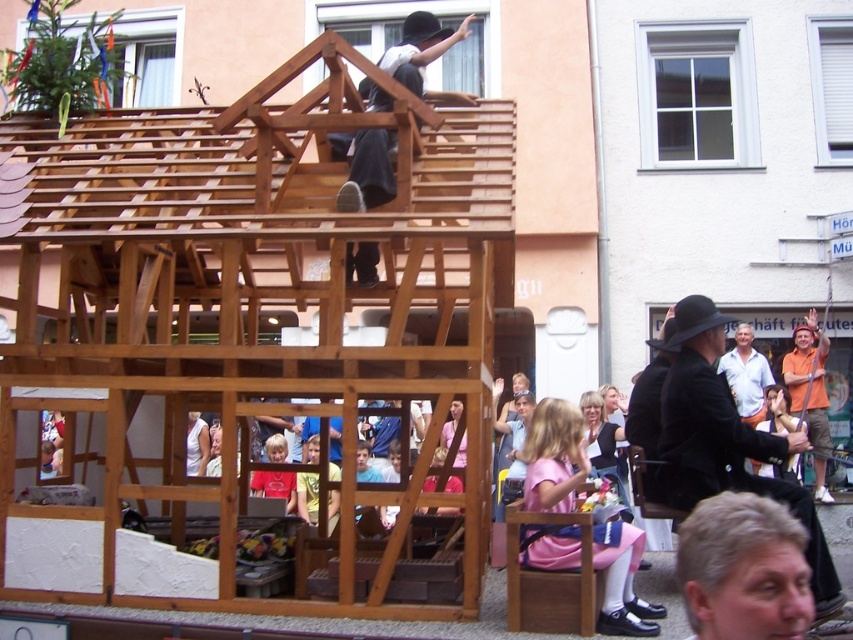
You are at the festival and want to sit down near the yellow fabric at lower center. Is the light brown wooden chair at lower right a good option?

The light brown wooden chair at lower right is to the right of the yellow fabric at lower center, so it is nearby and a good option to sit.

You are a photographer trying to capture the natural wood house at upper center and the gray matte hair at lower right in a single frame. Which object should you focus on first to ensure both are in the frame without moving the camera?

You should focus on the natural wood house at upper center first because it is larger and will require more attention to fit into the frame properly while ensuring the gray matte hair at lower right is also included.

You are standing at the camera position and want to reach the point marked as point (129, 552). If you walk straight ahead, will you reach that point?

Yes, because the point (129, 552) is 19.06 meters away from the camera position, so walking straight ahead in that direction will lead you to the point.